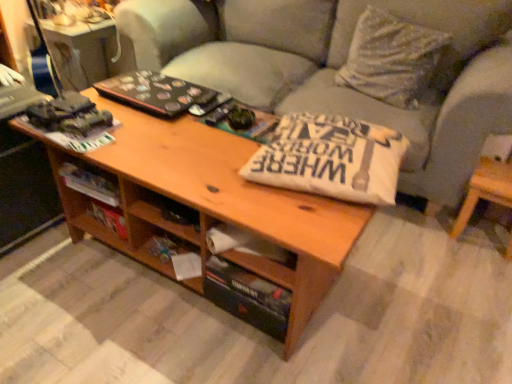
You are a GUI agent. You are given a task and a screenshot of the screen. Output one action in this format:
    pyautogui.click(x=<x>, y=<y>)
    Task: Click on the white cotton pillow at center
    Image resolution: width=512 pixels, height=384 pixels.
    Given the screenshot: What is the action you would take?
    pyautogui.click(x=330, y=158)

What are the coordinates of `wooden drawer at center` in the screenshot? It's located at (253, 253).

What are the coordinates of `light gray fabric couch at center` in the screenshot? It's located at (339, 67).

Is white textured pillow at upper right wider or thinner than light gray fabric couch at center?

white textured pillow at upper right is thinner than light gray fabric couch at center.

Does point (413, 50) appear closer or farther from the camera than point (421, 148)?

Point (413, 50) is positioned farther from the camera compared to point (421, 148).

Considering the sizes of objects white textured pillow at upper right and light gray fabric couch at center in the image provided, who is shorter, white textured pillow at upper right or light gray fabric couch at center?

Standing shorter between the two is white textured pillow at upper right.

At what (x,y) coordinates should I click in order to perform the action: click on studio couch located on the left of white textured pillow at upper right. Please return your answer as a coordinate pair (x, y). Looking at the image, I should click on (339, 67).

What's the angular difference between white cotton pillow at center and light brown wood side table at lower right's facing directions?

The angular difference between white cotton pillow at center and light brown wood side table at lower right is 5.05 degrees.

Would you consider white cotton pillow at center to be distant from light brown wood side table at lower right?

That's not correct — white cotton pillow at center is a little close to light brown wood side table at lower right.

Who is taller, white cotton pillow at center or light brown wood side table at lower right?

Standing taller between the two is light brown wood side table at lower right.

Which of these two, white cotton pillow at center or light brown wood side table at lower right, is bigger?

Bigger between the two is light brown wood side table at lower right.

At what (x,y) coordinates should I click in order to perform the action: click on studio couch lying on the right of white cotton pillow at center. Please return your answer as a coordinate pair (x, y). The image size is (512, 384). Looking at the image, I should click on (339, 67).

Is white cotton pillow at center looking in the opposite direction of light gray fabric couch at center?

Yes, white cotton pillow at center is positioned with its back facing light gray fabric couch at center.

Is white cotton pillow at center with light gray fabric couch at center?

white cotton pillow at center and light gray fabric couch at center are not in contact.

In the scene shown: From the image's perspective, is white cotton pillow at center over light gray fabric couch at center?

Actually, white cotton pillow at center appears below light gray fabric couch at center in the image.

Does light gray fabric couch at center touch white textured pillow at upper right?

There is a gap between light gray fabric couch at center and white textured pillow at upper right.

Is light gray fabric couch at center closer to camera compared to white textured pillow at upper right?

Yes, light gray fabric couch at center is in front of white textured pillow at upper right.

Looking at this image, does light gray fabric couch at center have a greater width compared to white textured pillow at upper right?

Indeed, light gray fabric couch at center has a greater width compared to white textured pillow at upper right.

From their relative heights in the image, would you say light gray fabric couch at center is taller or shorter than white textured pillow at upper right?

light gray fabric couch at center is taller than white textured pillow at upper right.

Does light gray fabric couch at center come behind wooden drawer at center?

Yes.

Find the location of a particular element. The image size is (512, 384). drawer lying on the left of light gray fabric couch at center is located at coordinates (253, 253).

From the image's perspective, which object appears higher, light gray fabric couch at center or wooden drawer at center?

light gray fabric couch at center, from the image's perspective.

How many degrees apart are the facing directions of light gray fabric couch at center and wooden drawer at center?

3 degrees separate the facing orientations of light gray fabric couch at center and wooden drawer at center.

Considering their positions, is white textured pillow at upper right located in front of or behind light brown wood side table at lower right?

In the image, white textured pillow at upper right appears behind light brown wood side table at lower right.

Does white textured pillow at upper right have a smaller size compared to light brown wood side table at lower right?

No.

Is white textured pillow at upper right taller or shorter than light brown wood side table at lower right?

Considering their sizes, white textured pillow at upper right has more height than light brown wood side table at lower right.

Between white cotton pillow at center and wooden drawer at center, which one appears on the right side from the viewer's perspective?

white cotton pillow at center is more to the right.

Considering their positions, is white cotton pillow at center located in front of or behind wooden drawer at center?

white cotton pillow at center is positioned closer to the viewer than wooden drawer at center.

Which is farther from the camera, (331, 191) or (262, 273)?

The point (262, 273) is behind.

There is a light gray fabric couch at center. In order to click on throw pillow above it (from a real-world perspective) in this screenshot , I will do `click(391, 58)`.

In the image, there is a light brown wood side table at lower right. Identify the location of pillow above it (from the image's perspective). (330, 158).

Looking at this image, when comparing their distances from white cotton pillow at center, does light gray fabric couch at center or light brown wood side table at lower right seem further?

Among the two, light gray fabric couch at center is located further to white cotton pillow at center.

From the picture: Which object lies further to the anchor point light gray fabric couch at center, white cotton pillow at center or light brown wood side table at lower right?

The object further to light gray fabric couch at center is white cotton pillow at center.

Based on their spatial positions, is light gray fabric couch at center or light brown wood side table at lower right closer to wooden drawer at center?

Among the two, light brown wood side table at lower right is located nearer to wooden drawer at center.

From the picture: Looking at the image, which one is located closer to light gray fabric couch at center, white cotton pillow at center or wooden drawer at center?

white cotton pillow at center is positioned closer to the anchor light gray fabric couch at center.

Estimate the real-world distances between objects in this image. Which object is closer to white textured pillow at upper right, light brown wood side table at lower right or white cotton pillow at center?

Based on the image, light brown wood side table at lower right appears to be nearer to white textured pillow at upper right.

When comparing their distances from wooden drawer at center, does light gray fabric couch at center or white textured pillow at upper right seem further?

white textured pillow at upper right lies further to wooden drawer at center than the other object.

Looking at the image, which one is located closer to light brown wood side table at lower right, light gray fabric couch at center or white textured pillow at upper right?

white textured pillow at upper right is closer to light brown wood side table at lower right.

Based on their spatial positions, is wooden drawer at center or white cotton pillow at center further from light gray fabric couch at center?

wooden drawer at center lies further to light gray fabric couch at center than the other object.

What are the coordinates of `throw pillow situated between white cotton pillow at center and light brown wood side table at lower right from left to right` in the screenshot? It's located at (391, 58).

At what (x,y) coordinates should I click in order to perform the action: click on pillow between wooden drawer at center and light brown wood side table at lower right. Please return your answer as a coordinate pair (x, y). Looking at the image, I should click on (330, 158).

At what (x,y) coordinates should I click in order to perform the action: click on throw pillow that lies between light gray fabric couch at center and wooden drawer at center from top to bottom. Please return your answer as a coordinate pair (x, y). This screenshot has width=512, height=384. Looking at the image, I should click on (391, 58).

This screenshot has width=512, height=384. I want to click on pillow between white textured pillow at upper right and wooden drawer at center in the vertical direction, so click(x=330, y=158).